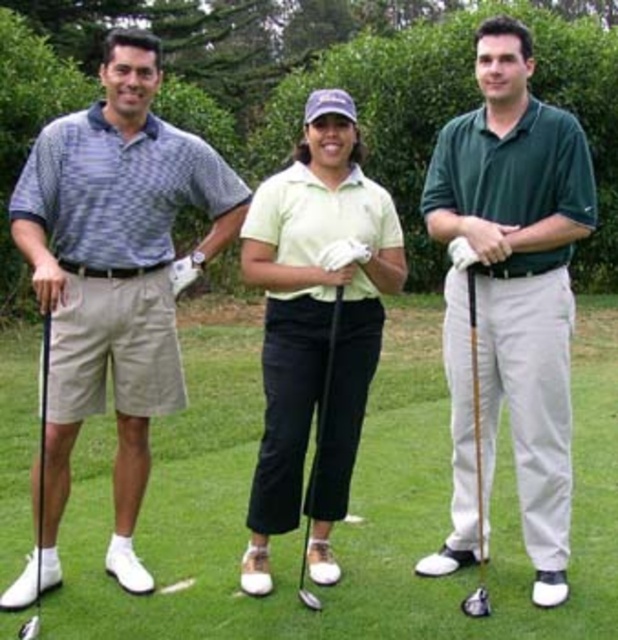
You are a photographer trying to capture a group photo of the green matte shirt at center and the white leather golf club at left. Based on their positions, can you tell which object is positioned higher in the image?

The green matte shirt at center is positioned higher than the white leather golf club at left in the image.

You are a golfer standing at the tee and need to place your golf club exactly at the center of the tee. The tee has a circular area with a radius of 0.5 meters. Can you determine if the wooden shaft golf club at center is within the tee area?

The wooden shaft golf club at center is positioned at point (476,461). To determine if it is within the tee area with a radius of 0.5 meters, we need to calculate the distance from the center of the tee to the club. If the distance is less than or equal to 0.5 meters, then it is within the area. However, without knowing the exact coordinates of the tee center, we cannot confirm this. Please provide the center coordinates of the tee for an accurate assessment.